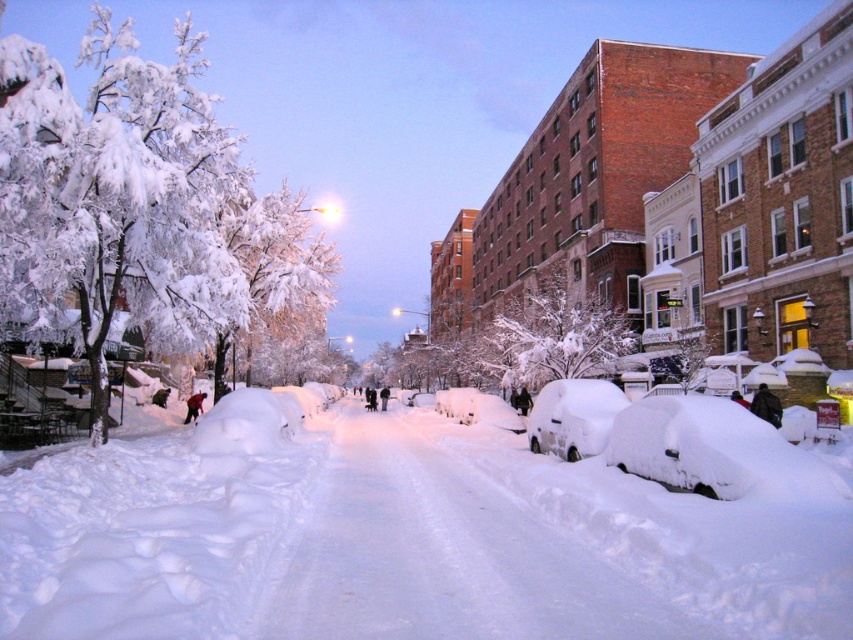
You are a delivery drone flying above the winter street scene. You need to land on the white fluffy snow at center. However, there is a white frosty tree at upper center nearby. Which object is shorter so you can safely land without hitting anything?

The white fluffy snow at center is not as tall as the white frosty tree at upper center, so the snow is shorter. Therefore, you can safely land on the white fluffy snow at center without hitting the taller tree.

Looking at this image, you are a city planner assessing the width of trees along a snowed street. You see the white frosty tree at left and the white frosty tree at center. Which tree has a greater width?

The white frosty tree at left might be wider than white frosty tree at center.